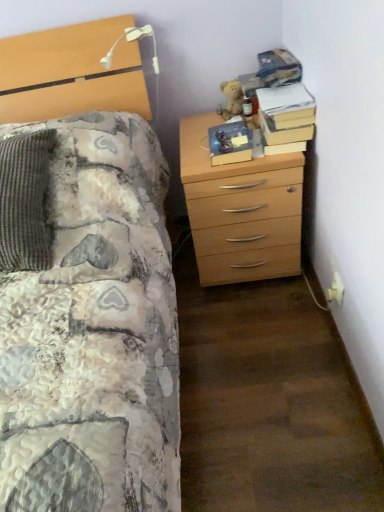
The image size is (384, 512). Identify the location of free space to the left of hardcover book at upper right, positioned as the 2th book in left-to-right order. (206, 140).